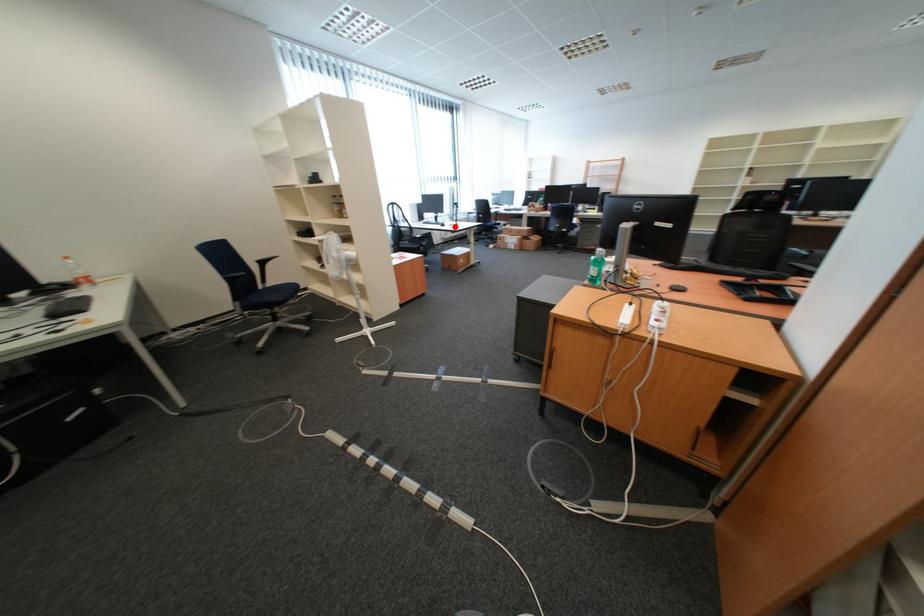
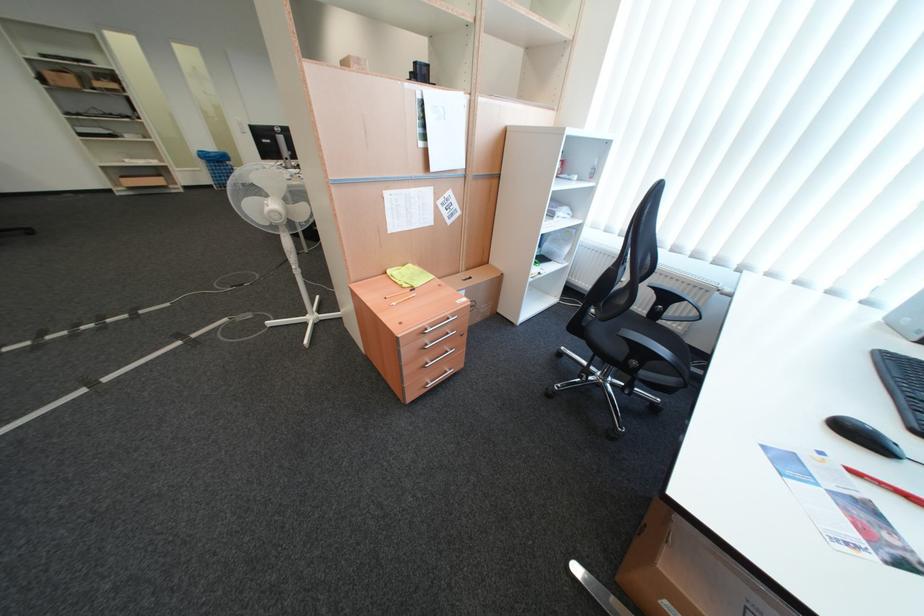
Question: I am providing you with two images of the same scene from different viewpoints. A red point is shown in image1. For the corresponding object point in image2, is it positioned nearer or farther from the camera?

Choices:
 (A) Nearer
 (B) Farther

Answer: (B)